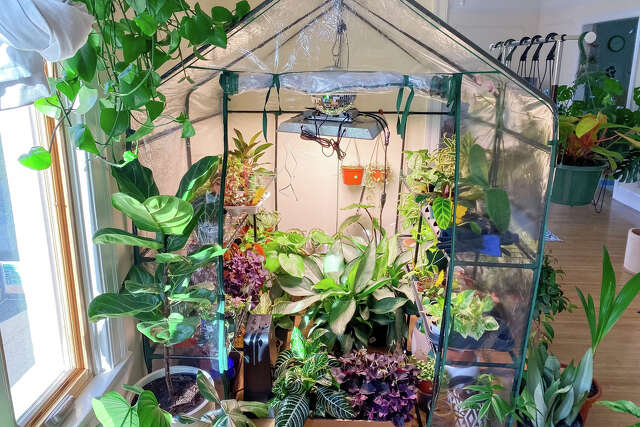
What are the coordinates of `light` in the screenshot? It's located at (332, 125).